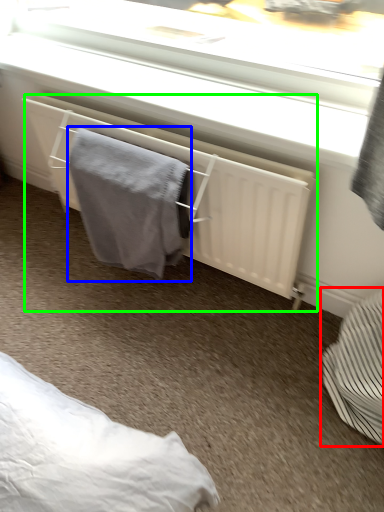
Question: Considering the real-world distances, which object is closest to furniture (highlighted by a red box)? bath towel (highlighted by a blue box) or radiator (highlighted by a green box).

Choices:
 (A) bath towel
 (B) radiator

Answer: (B)